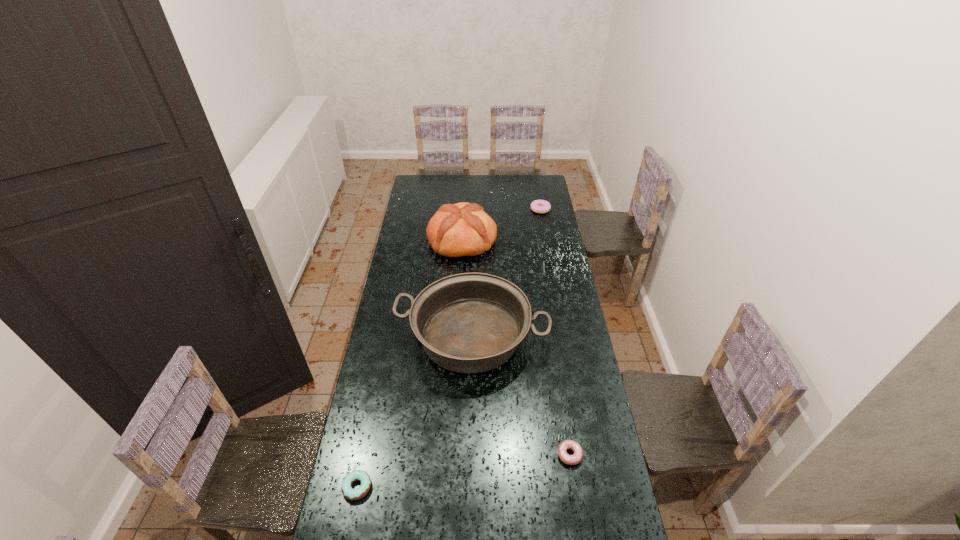
This screenshot has height=540, width=960. I want to click on free space located on the front of the third nearest object, so click(x=470, y=406).

This screenshot has height=540, width=960. I want to click on vacant space located 0.080m on the left of the third tallest object, so click(516, 210).

In order to click on free space located on the back of the second farthest doughnut in this screenshot , I will do `click(559, 386)`.

The width and height of the screenshot is (960, 540). What are the coordinates of `free region located on the back of the leftmost doughnut` in the screenshot? It's located at (369, 430).

This screenshot has height=540, width=960. In order to click on bread that is at the left edge in this screenshot , I will do `click(463, 229)`.

Where is `pan present at the left edge`? pan present at the left edge is located at coordinates (470, 322).

Image resolution: width=960 pixels, height=540 pixels. Identify the location of doughnut at the left edge. (352, 494).

The height and width of the screenshot is (540, 960). I want to click on pan at the right edge, so click(x=470, y=322).

In the image, there is a desktop. Where is `free region at the left edge`? The width and height of the screenshot is (960, 540). free region at the left edge is located at coordinates (419, 225).

Identify the location of free space at the right edge of the desktop. (576, 434).